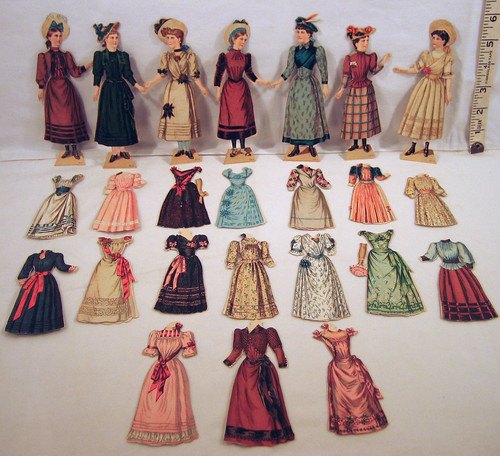
Image resolution: width=500 pixels, height=456 pixels. In order to click on dolls in this screenshot , I will do `click(62, 90)`, `click(110, 92)`, `click(185, 72)`, `click(235, 70)`, `click(310, 103)`, `click(363, 96)`, `click(433, 92)`.